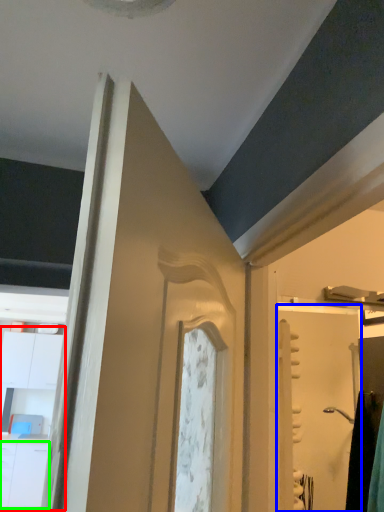
Question: Which object is the closest to the dresser (highlighted by a red box)? Choose among these: screen door (highlighted by a blue box) or drawer (highlighted by a green box).

Choices:
 (A) screen door
 (B) drawer

Answer: (B)